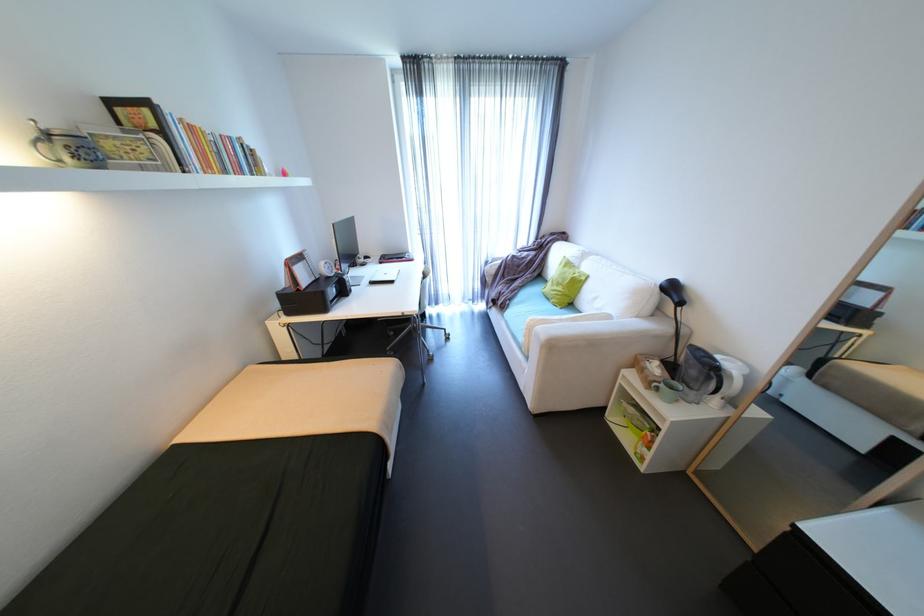
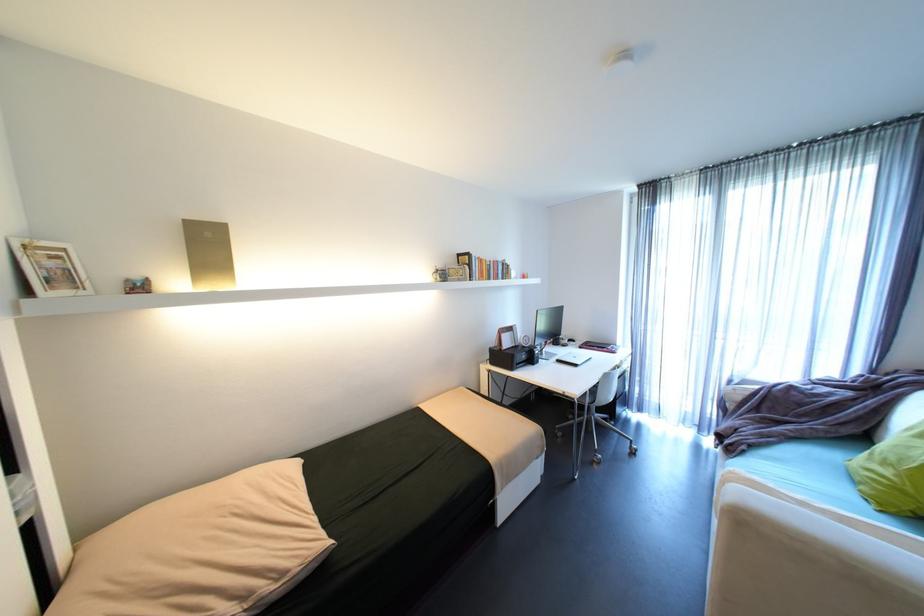
Question: The first image is from the beginning of the video and the second image is from the end. How did the camera likely rotate when shooting the video?

Choices:
 (A) Left
 (B) Right
 (C) Up
 (D) Down

Answer: (A)